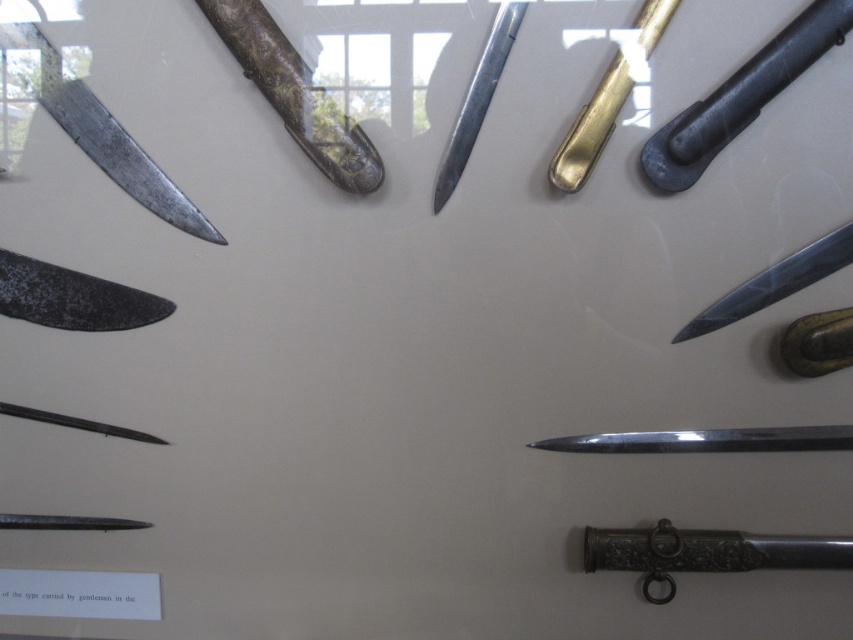
Is polished dark metal sword at bottom right smaller than shiny silver knife at right?

No.

Does point (677, 548) lie in front of point (776, 269)?

No, it is not.

Where is `polished dark metal sword at bottom right`? This screenshot has height=640, width=853. polished dark metal sword at bottom right is located at coordinates (705, 552).

Measure the distance between black matte sword at upper right and camera.

black matte sword at upper right and camera are 1.06 meters apart.

Is black matte sword at upper right further to the viewer compared to rusty metal sword at upper left?

No, black matte sword at upper right is closer to the viewer.

At what (x,y) coordinates should I click in order to perform the action: click on black matte sword at upper right. Please return your answer as a coordinate pair (x, y). Looking at the image, I should click on (741, 97).

Where is `black matte sword at upper right`? The image size is (853, 640). black matte sword at upper right is located at coordinates (741, 97).

Between gold polished sword at upper center and shiny silver knife at right, which one is positioned lower?

shiny silver knife at right is below.

Can you confirm if gold polished sword at upper center is smaller than shiny silver knife at right?

No.

This screenshot has width=853, height=640. What are the coordinates of `gold polished sword at upper center` in the screenshot? It's located at (590, 129).